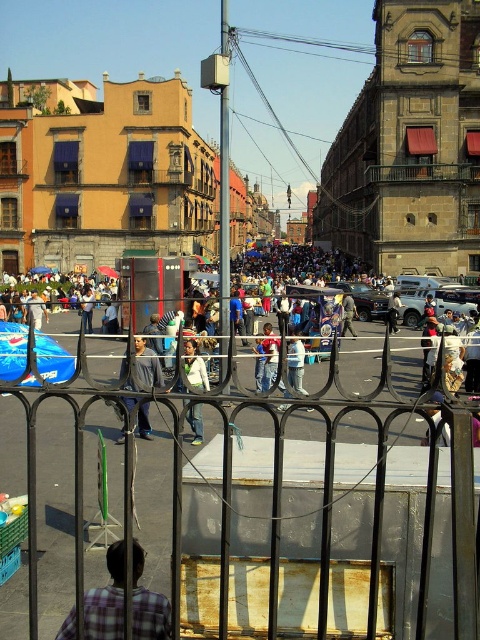
Question: Among these objects, which one is nearest to the camera?

Choices:
 (A) white matte jacket at center
 (B) plaid shirt at lower left
 (C) denim pants at center
 (D) light gray shirt at center

Answer: (B)

Question: Which point is closer to the camera?

Choices:
 (A) (144, 412)
 (B) (90, 307)

Answer: (A)

Question: Which point appears closest to the camera in this image?

Choices:
 (A) (119, 440)
 (B) (113, 561)
 (C) (385, 525)

Answer: (B)

Question: Does black wrought iron fence at center appear under plaid shirt at lower left?

Choices:
 (A) yes
 (B) no

Answer: (B)

Question: Is black wrought iron fence at center below denim pants at center?

Choices:
 (A) yes
 (B) no

Answer: (A)

Question: Considering the relative positions of white matte jacket at center and light brown leather jacket at center in the image provided, where is white matte jacket at center located with respect to light brown leather jacket at center?

Choices:
 (A) above
 (B) below

Answer: (B)